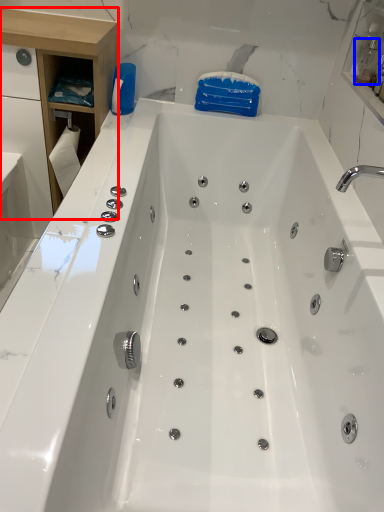
Question: Which object appears farthest to the camera in this image, cabinetry (highlighted by a red box) or bottle (highlighted by a blue box)?

Choices:
 (A) cabinetry
 (B) bottle

Answer: (B)